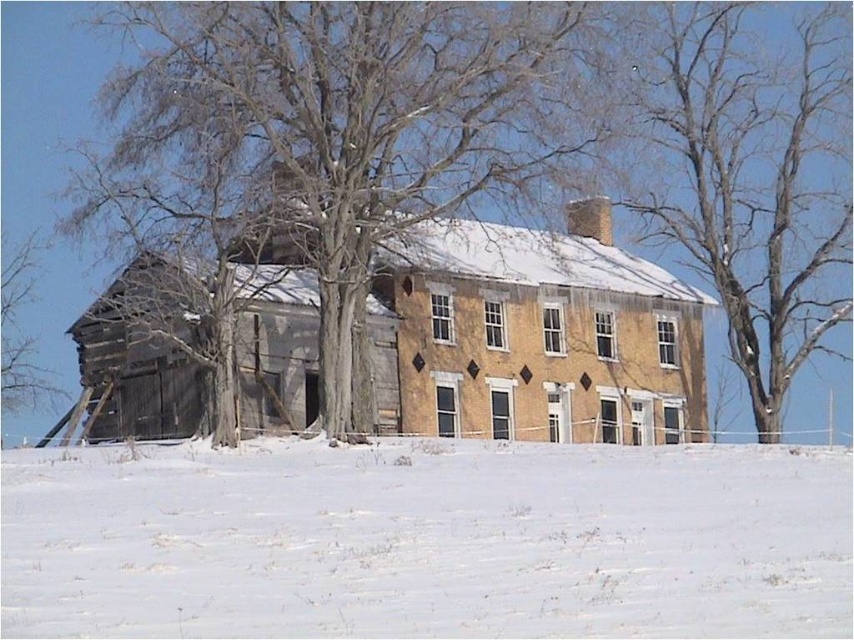
You are standing in front of the house and want to walk towards the white powdery snow at lower center. Which direction should you move relative to the bare wood tree at left?

The white powdery snow at lower center is to the right of the bare wood tree at left, so you should move towards the right side of the bare wood tree at left to reach it.

You are standing at the point marked as point (427,540) and want to walk towards the house. Is there any obstacle blocking your path? Please explain.

The white powdery snow at lower center is located at point (427,540). Since you are standing on the snow itself, there is no obstacle blocking your path towards the house.